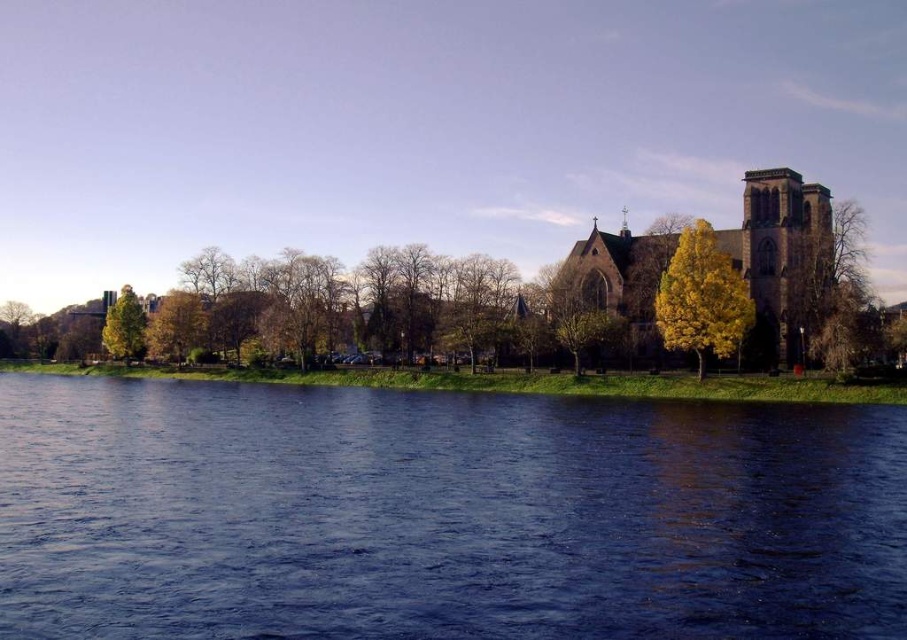
Does brown stone church at center appear over green leafy tree at left?

Yes, brown stone church at center is above green leafy tree at left.

Does brown stone church at center come behind green leafy tree at left?

No, brown stone church at center is in front of green leafy tree at left.

Where is `brown stone church at center`? Image resolution: width=907 pixels, height=640 pixels. brown stone church at center is located at coordinates (779, 253).

In order to click on brown stone church at center in this screenshot , I will do `click(779, 253)`.

Does green leafy tree at right appear under green leafy tree at left?

Actually, green leafy tree at right is above green leafy tree at left.

The width and height of the screenshot is (907, 640). What do you see at coordinates (835, 291) in the screenshot?
I see `green leafy tree at right` at bounding box center [835, 291].

Does point (847, 212) come farther from viewer compared to point (110, 316)?

No, it is not.

Identify the location of green leafy tree at right. This screenshot has height=640, width=907. (835, 291).

Is point (290, 424) positioned before point (128, 349)?

Yes, it is in front of point (128, 349).

Does blue water at lower center appear under green leafy tree at left?

Correct, blue water at lower center is located below green leafy tree at left.

Does point (111, 582) come in front of point (130, 289)?

Yes, it is.

Find the location of a particular element. This screenshot has width=907, height=640. blue water at lower center is located at coordinates (441, 515).